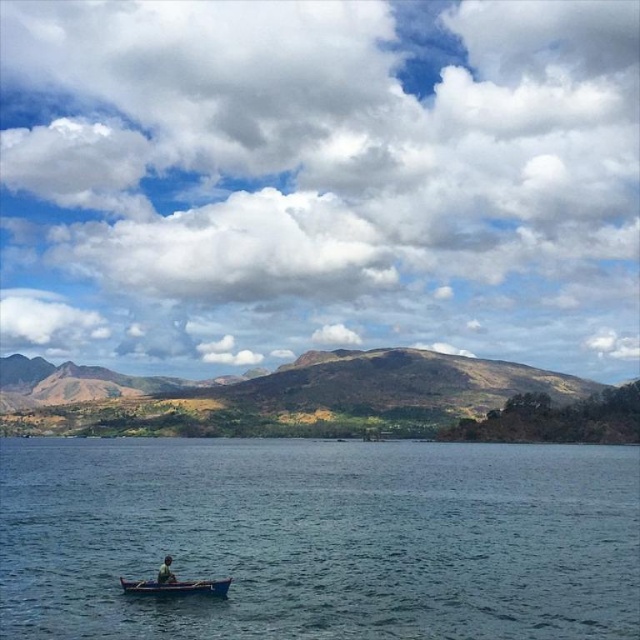
Question: Which point is closer to the camera?

Choices:
 (A) blue water at center
 (B) blue wooden canoe at lower center

Answer: (A)

Question: Does blue water at center appear under blue wooden canoe at lower center?

Choices:
 (A) yes
 (B) no

Answer: (A)

Question: Considering the relative positions of blue wooden canoe at lower center and blue fabric person at lower left in the image provided, where is blue wooden canoe at lower center located with respect to blue fabric person at lower left?

Choices:
 (A) left
 (B) right

Answer: (A)

Question: Among these objects, which one is nearest to the camera?

Choices:
 (A) blue water at center
 (B) blue wooden canoe at lower center
 (C) blue fabric person at lower left

Answer: (A)

Question: Does blue wooden canoe at lower center have a larger size compared to blue fabric person at lower left?

Choices:
 (A) yes
 (B) no

Answer: (B)

Question: Based on their relative distances, which object is nearer to the blue fabric person at lower left?

Choices:
 (A) blue water at center
 (B) blue wooden canoe at lower center

Answer: (B)